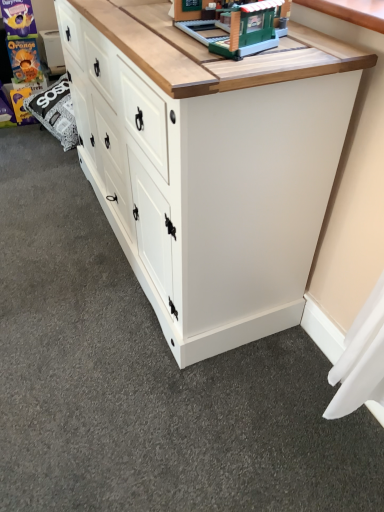
Question: Considering the positions of white painted wood chest of drawers at center and green plastic building at upper center in the image, is white painted wood chest of drawers at center taller or shorter than green plastic building at upper center?

Choices:
 (A) short
 (B) tall

Answer: (B)

Question: Is white painted wood chest of drawers at center spatially inside green plastic building at upper center, or outside of it?

Choices:
 (A) outside
 (B) inside

Answer: (A)

Question: Looking at the image, does white painted wood chest of drawers at center seem bigger or smaller compared to green plastic building at upper center?

Choices:
 (A) small
 (B) big

Answer: (B)

Question: From the image's perspective, is green plastic building at upper center positioned above or below white painted wood chest of drawers at center?

Choices:
 (A) below
 (B) above

Answer: (B)

Question: Does point (243, 8) appear closer or farther from the camera than point (79, 74)?

Choices:
 (A) farther
 (B) closer

Answer: (B)

Question: Considering their positions, is green plastic building at upper center located in front of or behind white painted wood chest of drawers at center?

Choices:
 (A) behind
 (B) front

Answer: (A)

Question: Is green plastic building at upper center situated inside white painted wood chest of drawers at center or outside?

Choices:
 (A) outside
 (B) inside

Answer: (A)